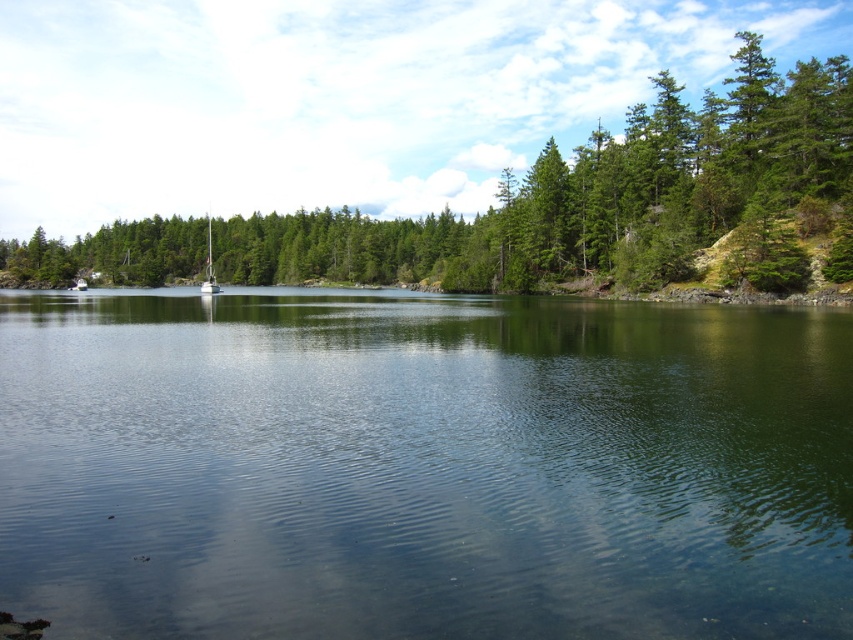
Is clear water at center shorter than green matte tree at center?

Yes, clear water at center is shorter than green matte tree at center.

Can you confirm if clear water at center is positioned to the left of green matte tree at center?

Yes, clear water at center is to the left of green matte tree at center.

Does point (247, 330) lie in front of point (782, 262)?

Yes, point (247, 330) is in front of point (782, 262).

This screenshot has height=640, width=853. I want to click on clear water at center, so click(x=422, y=465).

In the scene shown: Is clear water at center wider than white glossy sailboat at center?

Yes, clear water at center is wider than white glossy sailboat at center.

Does clear water at center appear over white glossy sailboat at center?

No.

Is point (573, 380) in front of point (213, 291)?

That is True.

At what (x,y) coordinates should I click in order to perform the action: click on clear water at center. Please return your answer as a coordinate pair (x, y). The width and height of the screenshot is (853, 640). Looking at the image, I should click on (422, 465).

This screenshot has width=853, height=640. Describe the element at coordinates (607, 198) in the screenshot. I see `green matte tree at center` at that location.

Does green matte tree at center have a larger size compared to white glossy sailboat at center?

Indeed, green matte tree at center has a larger size compared to white glossy sailboat at center.

Who is more forward, (618,204) or (212,292)?

Positioned in front is point (618,204).

What are the coordinates of `green matte tree at center` in the screenshot? It's located at (607, 198).